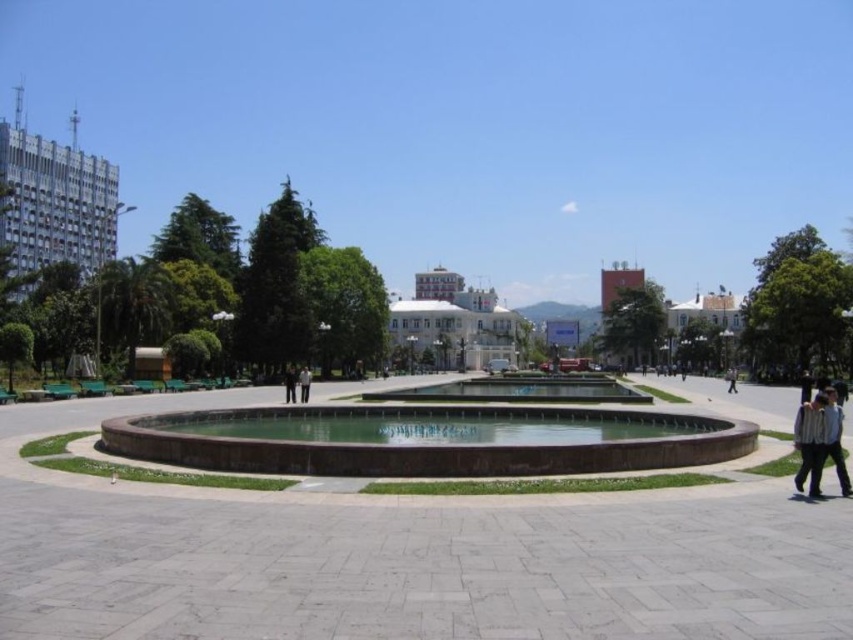
You are a photographer standing in the urban plaza and want to capture both the brown stone fountain at center and the dark gray suit at center in a single frame. Based on their positions, which object should you focus on first to ensure both are in the shot?

The brown stone fountain at center is located below the dark gray suit at center, so you should focus on the dark gray suit at center first to ensure both are in the frame.